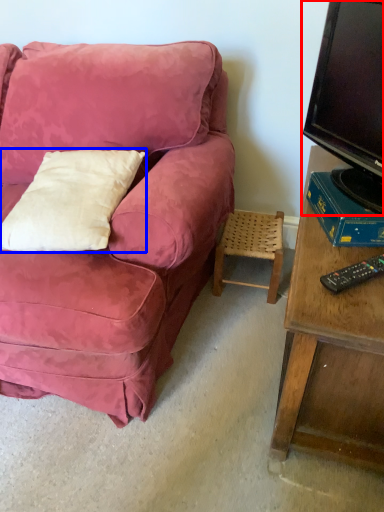
Question: Which object appears closest to the camera in this image, television (highlighted by a red box) or pillow (highlighted by a blue box)?

Choices:
 (A) television
 (B) pillow

Answer: (A)